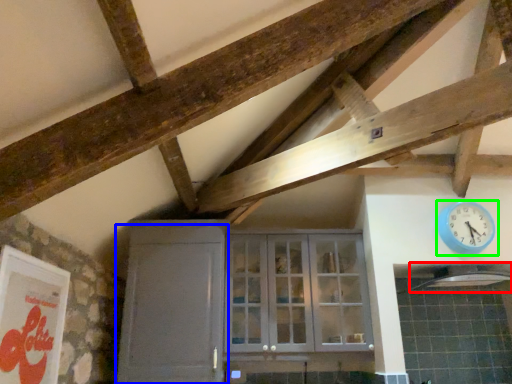
Question: Based on their relative distances, which object is nearer to exhaust hood (highlighted by a red box)? Choose from door (highlighted by a blue box) and wall clock (highlighted by a green box).

Choices:
 (A) door
 (B) wall clock

Answer: (B)